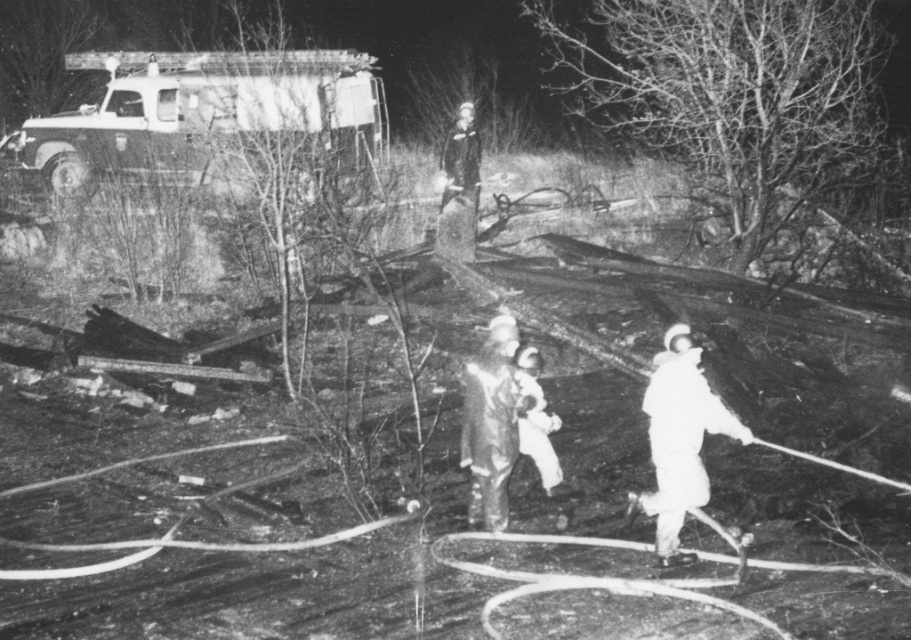
Question: Which of the following is the closest to the observer?

Choices:
 (A) dark gray uniform at center
 (B) rubberized white suit at center

Answer: (B)

Question: Which point is farther to the camera?

Choices:
 (A) white matte hazmat suit at right
 (B) bare branches at upper right
 (C) dark gray uniform at center
 (D) smooth bark tree at upper left

Answer: (C)

Question: Which point is farther from the camera taking this photo?

Choices:
 (A) (529, 360)
 (B) (442, 225)
 (C) (735, 193)
 (D) (186, 100)

Answer: (D)

Question: Is bare branches at upper right further to the viewer compared to white matte uniform at center?

Choices:
 (A) no
 (B) yes

Answer: (B)

Question: Is white matte hazmat suit at right smaller than white matte uniform at center?

Choices:
 (A) yes
 (B) no

Answer: (B)

Question: Does white matte hazmat suit at right appear on the right side of rubberized white suit at center?

Choices:
 (A) yes
 (B) no

Answer: (A)